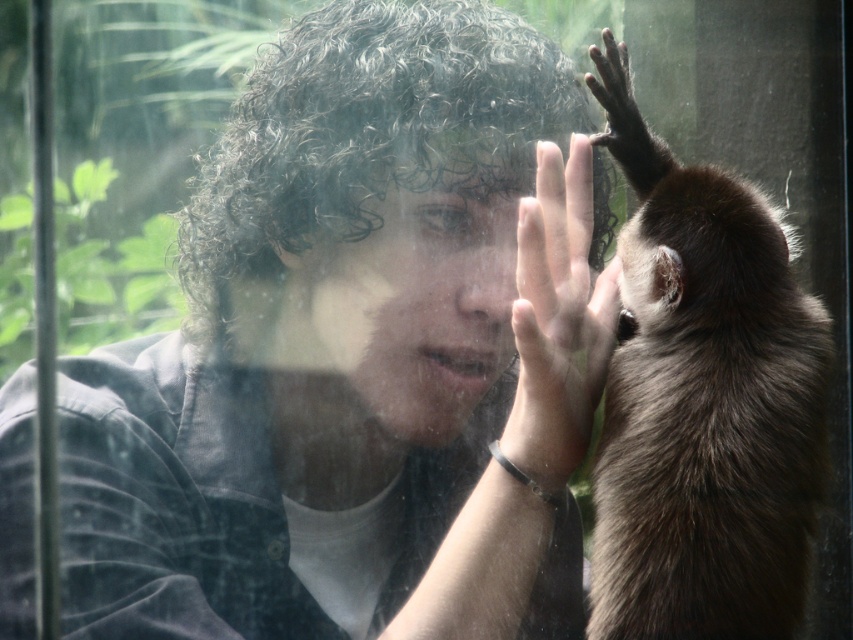
Question: Estimate the real-world distances between objects in this image. Which object is farther from the brown furry monkey at upper right?

Choices:
 (A) smooth skin hand at center
 (B) matte black shirt at center

Answer: (B)

Question: Does matte black shirt at center appear on the left side of brown furry monkey at upper right?

Choices:
 (A) yes
 (B) no

Answer: (A)

Question: Which point appears farthest from the camera in this image?

Choices:
 (A) (784, 358)
 (B) (554, 227)
 (C) (300, 353)

Answer: (C)

Question: Can you confirm if matte black shirt at center is bigger than smooth skin hand at center?

Choices:
 (A) yes
 (B) no

Answer: (A)

Question: Is matte black shirt at center positioned behind smooth skin hand at center?

Choices:
 (A) yes
 (B) no

Answer: (A)

Question: Which point is farther from the camera taking this photo?

Choices:
 (A) (630, 564)
 (B) (515, 291)
 (C) (250, 500)

Answer: (B)